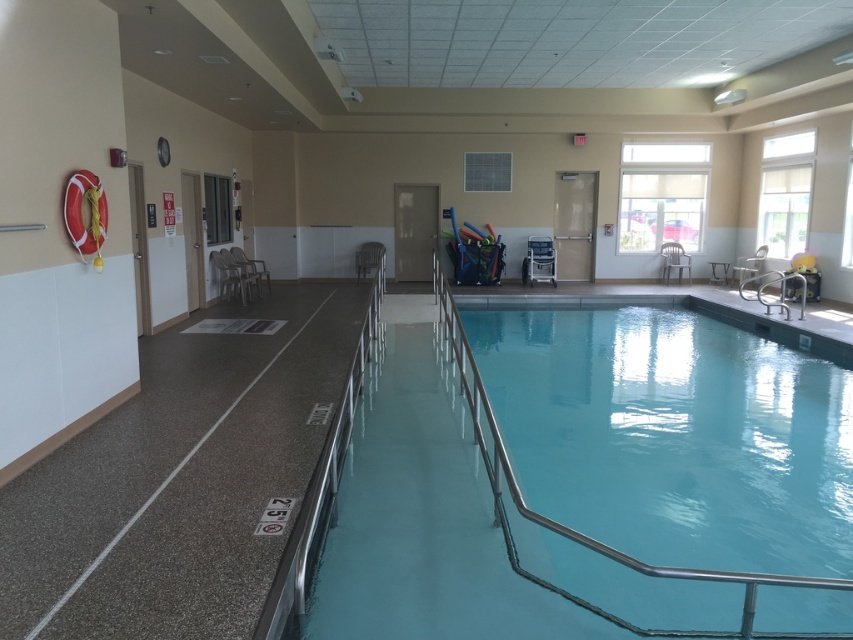
You are standing at the entrance of the indoor pool area and see the metallic silver chair at center. If you want to reach the chair quickly, should you walk straight ahead or turn left? Explain your reasoning based on the scene description.

Based on the scene description, the metallic silver chair at center is positioned directly in front of you since it is at the center of the pool area. Walking straight ahead would be the quickest path to reach the metallic silver chair at center.

In the scene shown: You are a lifeguard standing at the edge of the pool. You need to quickly assess whether the metallic silver chair at center can fit entirely within the smooth blue water at center. Based on their sizes, what would you conclude?

The smooth blue water at center is larger in size than the metallic silver chair at center, so the chair can fit entirely within the water.

You are a swimmer who wants to sit down after a swim. You see the smooth blue water at center and the blue plastic chair at center. Which one is a better place to sit?

The blue plastic chair at center is a better place to sit because the smooth blue water at center is larger in size but likely not suitable for sitting as it is water.